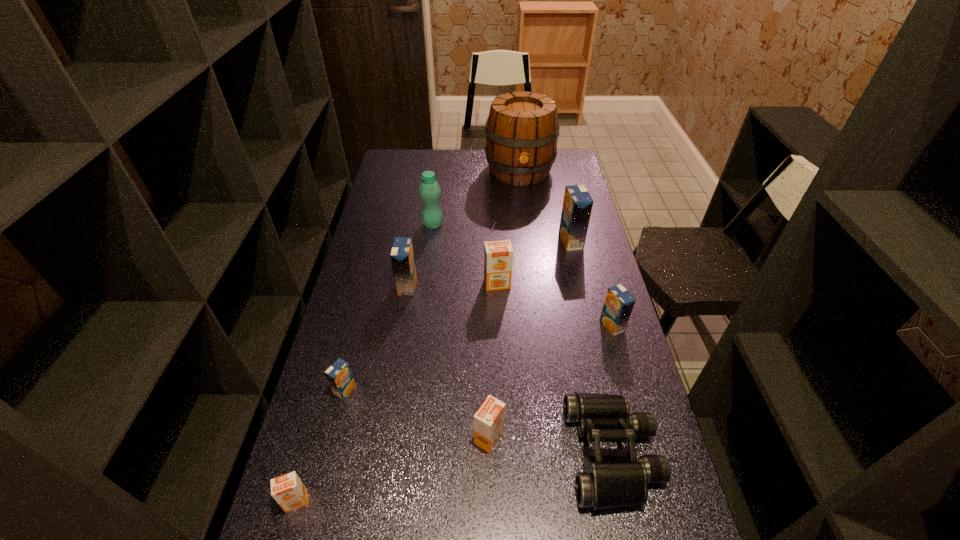
Where is `empty space between the bottle and the nearest blue orange_juice`? The width and height of the screenshot is (960, 540). empty space between the bottle and the nearest blue orange_juice is located at coordinates (389, 307).

The width and height of the screenshot is (960, 540). In order to click on vacant point located between the farthest orange orange juice and the nearest blue orange_juice in this screenshot , I will do `click(421, 337)`.

Where is `empty space that is in between the cider and the second farthest orange orange juice`? The height and width of the screenshot is (540, 960). empty space that is in between the cider and the second farthest orange orange juice is located at coordinates [x=504, y=305].

Identify the location of vacant space that is in between the leftmost orange orange juice and the second smallest blue orange_juice. Image resolution: width=960 pixels, height=540 pixels. (454, 413).

Identify the location of vacant area that lies between the farthest blue orange_juice and the bottle. This screenshot has width=960, height=540. (502, 233).

Where is `free space between the second nearest blue orange_juice and the binoculars`? This screenshot has height=540, width=960. free space between the second nearest blue orange_juice and the binoculars is located at coordinates (612, 389).

The width and height of the screenshot is (960, 540). Find the location of `vacant point located between the farthest orange orange juice and the third nearest blue orange_juice`. vacant point located between the farthest orange orange juice and the third nearest blue orange_juice is located at coordinates tap(452, 285).

Where is `object that is the fifth closest to the farthest orange juice`? This screenshot has width=960, height=540. object that is the fifth closest to the farthest orange juice is located at coordinates (402, 254).

I want to click on object that is the ninth closest to the tallest object, so (288, 490).

You are a GUI agent. You are given a task and a screenshot of the screen. Output one action in this format:
    pyautogui.click(x=<x>, y=<y>)
    Task: Click on the second closest orange juice to the second farthest object
    The height and width of the screenshot is (540, 960).
    Given the screenshot: What is the action you would take?
    pyautogui.click(x=498, y=255)